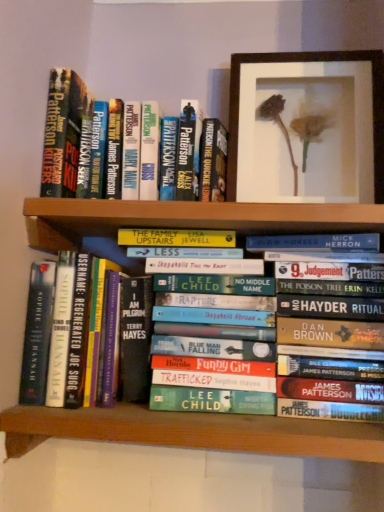
Image resolution: width=384 pixels, height=512 pixels. Describe the element at coordinates (61, 330) in the screenshot. I see `hardcover book at left, the third book in the top-to-bottom sequence` at that location.

What do you see at coordinates (306, 127) in the screenshot?
I see `wooden framed flower at upper center` at bounding box center [306, 127].

The image size is (384, 512). In order to click on green matte bookshelf at lower center in this screenshot , I will do `click(193, 431)`.

From the image's perspective, does hardcover book at left, which is counted as the 1th book, starting from the bottom, appear higher than hardcover book at center, marked as the second book in a bottom-to-top arrangement?

No.

Based on the photo, looking at the image, does hardcover book at left, which is counted as the 1th book, starting from the bottom, seem bigger or smaller compared to hardcover book at center, marked as the second book in a bottom-to-top arrangement?

Clearly, hardcover book at left, which is counted as the 1th book, starting from the bottom, is smaller in size than hardcover book at center, marked as the second book in a bottom-to-top arrangement.

Based on the photo, which is more to the right, hardcover book at left, which is counted as the 1th book, starting from the bottom, or hardcover book at center, marked as the second book in a bottom-to-top arrangement?

From the viewer's perspective, hardcover book at center, marked as the second book in a bottom-to-top arrangement, appears more on the right side.

Considering the relative sizes of hardcover book at left, which is counted as the 1th book, starting from the bottom, and hardcover book at center, the 2th book when ordered from top to bottom, in the image provided, is hardcover book at left, which is counted as the 1th book, starting from the bottom, shorter than hardcover book at center, the 2th book when ordered from top to bottom,?

Yes.

Which of these two, wooden framed flower at upper center or green matte bookshelf at lower center, is bigger?

With larger size is green matte bookshelf at lower center.

Would you say wooden framed flower at upper center is inside or outside green matte bookshelf at lower center?

wooden framed flower at upper center is not enclosed by green matte bookshelf at lower center.

How much distance is there between wooden framed flower at upper center and green matte bookshelf at lower center?

19.28 inches.

Can you confirm if wooden framed flower at upper center is wider than green matte bookshelf at lower center?

In fact, wooden framed flower at upper center might be narrower than green matte bookshelf at lower center.

Can we say wooden framed flower at upper center lies outside hardcover book at center, the 2th book when ordered from top to bottom?

Yes, wooden framed flower at upper center is not within hardcover book at center, the 2th book when ordered from top to bottom.

What's the angular difference between wooden framed flower at upper center and hardcover book at center, marked as the second book in a bottom-to-top arrangement,'s facing directions?

The angle between the facing direction of wooden framed flower at upper center and the facing direction of hardcover book at center, marked as the second book in a bottom-to-top arrangement, is 1.56 degrees.

From a real-world perspective, which object stands above the other?

wooden framed flower at upper center.

In terms of height, does wooden framed flower at upper center look taller or shorter compared to hardcover book at center, the 2th book when ordered from top to bottom?

Considering their sizes, wooden framed flower at upper center has less height than hardcover book at center, the 2th book when ordered from top to bottom.

Looking at this image, in terms of size, does green matte bookshelf at lower center appear bigger or smaller than hardcover book at left, which is counted as the 1th book, starting from the bottom?

Clearly, green matte bookshelf at lower center is larger in size than hardcover book at left, which is counted as the 1th book, starting from the bottom.

Considering the relative positions of green matte bookshelf at lower center and hardcover book at left, which is counted as the 1th book, starting from the bottom, in the image provided, is green matte bookshelf at lower center to the left of hardcover book at left, which is counted as the 1th book, starting from the bottom, from the viewer's perspective?

Incorrect, green matte bookshelf at lower center is not on the left side of hardcover book at left, which is counted as the 1th book, starting from the bottom.

Where is `the 2nd book behind the green matte bookshelf at lower center, starting your count from the anchor`? The image size is (384, 512). the 2nd book behind the green matte bookshelf at lower center, starting your count from the anchor is located at coordinates (61, 330).

Does wooden framed flower at upper center have a larger size compared to hardcover book at left, which is counted as the 1th book, starting from the bottom?

Incorrect, wooden framed flower at upper center is not larger than hardcover book at left, which is counted as the 1th book, starting from the bottom.

From the image's perspective, which is above, wooden framed flower at upper center or hardcover book at left, the third book in the top-to-bottom sequence?

wooden framed flower at upper center.

Is point (243, 132) positioned behind point (95, 265)?

Yes, point (243, 132) is behind point (95, 265).

Is wooden framed flower at upper center shorter than hardcover book at left, which is counted as the 1th book, starting from the bottom?

Incorrect, the height of wooden framed flower at upper center does not fall short of that of hardcover book at left, which is counted as the 1th book, starting from the bottom.

Is hardcover book at upper left, positioned as the third book in bottom-to-top order, at the left side of green matte bookshelf at lower center?

Correct, you'll find hardcover book at upper left, positioned as the third book in bottom-to-top order, to the left of green matte bookshelf at lower center.

What are the coordinates of `shelf below the hardcover book at upper left, positioned as the third book in bottom-to-top order (from the image's perspective)` in the screenshot? It's located at tap(193, 431).

How different are the orientations of hardcover book at upper left, which is counted as the first book, starting from the top, and green matte bookshelf at lower center in degrees?

There is a 0.117-degree angle between the facing directions of hardcover book at upper left, which is counted as the first book, starting from the top, and green matte bookshelf at lower center.

Considering the sizes of objects hardcover book at upper left, positioned as the third book in bottom-to-top order, and green matte bookshelf at lower center in the image provided, who is smaller, hardcover book at upper left, positioned as the third book in bottom-to-top order, or green matte bookshelf at lower center?

hardcover book at upper left, positioned as the third book in bottom-to-top order, is smaller.

Is hardcover book at left, the third book in the top-to-bottom sequence, oriented towards green matte bookshelf at lower center?

No, hardcover book at left, the third book in the top-to-bottom sequence, is not turned towards green matte bookshelf at lower center.

Is hardcover book at left, the third book in the top-to-bottom sequence, further to camera compared to green matte bookshelf at lower center?

Yes, hardcover book at left, the third book in the top-to-bottom sequence, is further from the camera.

From a real-world perspective, is hardcover book at left, the third book in the top-to-bottom sequence, below green matte bookshelf at lower center?

Actually, hardcover book at left, the third book in the top-to-bottom sequence, is physically above green matte bookshelf at lower center in the real world.

At what (x,y) coordinates should I click in order to perform the action: click on the 2nd book to the left of the hardcover book at center, marked as the second book in a bottom-to-top arrangement, starting your count from the anchor. Please return your answer as a coordinate pair (x, y). Looking at the image, I should click on (61, 330).

The image size is (384, 512). Identify the location of picture frame that is above the green matte bookshelf at lower center (from the image's perspective). (306, 127).

From the image, which object appears to be nearer to wooden framed flower at upper center, hardcover book at left, which is counted as the 1th book, starting from the bottom, or hardcover book at upper left, which is counted as the first book, starting from the top?

hardcover book at upper left, which is counted as the first book, starting from the top.

Estimate the real-world distances between objects in this image. Which object is further from wooden framed flower at upper center, hardcover book at upper left, which is counted as the first book, starting from the top, or hardcover book at left, which is counted as the 1th book, starting from the bottom?

The object further to wooden framed flower at upper center is hardcover book at left, which is counted as the 1th book, starting from the bottom.

Based on their spatial positions, is hardcover book at left, the third book in the top-to-bottom sequence, or wooden framed flower at upper center closer to hardcover book at center, marked as the second book in a bottom-to-top arrangement?

hardcover book at left, the third book in the top-to-bottom sequence, is positioned closer to the anchor hardcover book at center, marked as the second book in a bottom-to-top arrangement.

Estimate the real-world distances between objects in this image. Which object is closer to green matte bookshelf at lower center, hardcover book at upper left, positioned as the third book in bottom-to-top order, or hardcover book at center, marked as the second book in a bottom-to-top arrangement?

hardcover book at center, marked as the second book in a bottom-to-top arrangement, is closer to green matte bookshelf at lower center.

Based on their spatial positions, is green matte bookshelf at lower center or hardcover book at center, marked as the second book in a bottom-to-top arrangement, further from wooden framed flower at upper center?

The object further to wooden framed flower at upper center is green matte bookshelf at lower center.

When comparing their distances from hardcover book at upper left, which is counted as the first book, starting from the top, does hardcover book at center, the 2th book when ordered from top to bottom, or green matte bookshelf at lower center seem further?

green matte bookshelf at lower center.

Estimate the real-world distances between objects in this image. Which object is further from green matte bookshelf at lower center, hardcover book at left, the third book in the top-to-bottom sequence, or hardcover book at upper left, which is counted as the first book, starting from the top?

hardcover book at upper left, which is counted as the first book, starting from the top, lies further to green matte bookshelf at lower center than the other object.

Based on their spatial positions, is green matte bookshelf at lower center or hardcover book at left, the third book in the top-to-bottom sequence, further from hardcover book at center, the 2th book when ordered from top to bottom?

hardcover book at left, the third book in the top-to-bottom sequence, is positioned further to the anchor hardcover book at center, the 2th book when ordered from top to bottom.

At what (x,y) coordinates should I click in order to perform the action: click on book between hardcover book at center, the 2th book when ordered from top to bottom, and green matte bookshelf at lower center in the up-down direction. Please return your answer as a coordinate pair (x, y). This screenshot has height=512, width=384. Looking at the image, I should click on (61, 330).

I want to click on book between wooden framed flower at upper center and hardcover book at center, marked as the second book in a bottom-to-top arrangement, in the vertical direction, so click(80, 141).

I want to click on book that lies between hardcover book at upper left, positioned as the third book in bottom-to-top order, and hardcover book at left, the third book in the top-to-bottom sequence, from top to bottom, so click(263, 355).